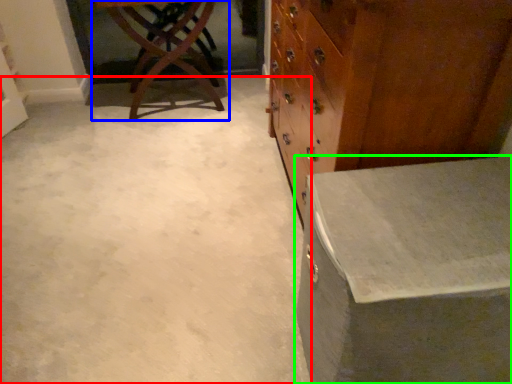
Question: Considering the real-world distances, which object is closest to concrete (highlighted by a red box)? table (highlighted by a blue box) or table (highlighted by a green box).

Choices:
 (A) table
 (B) table

Answer: (B)